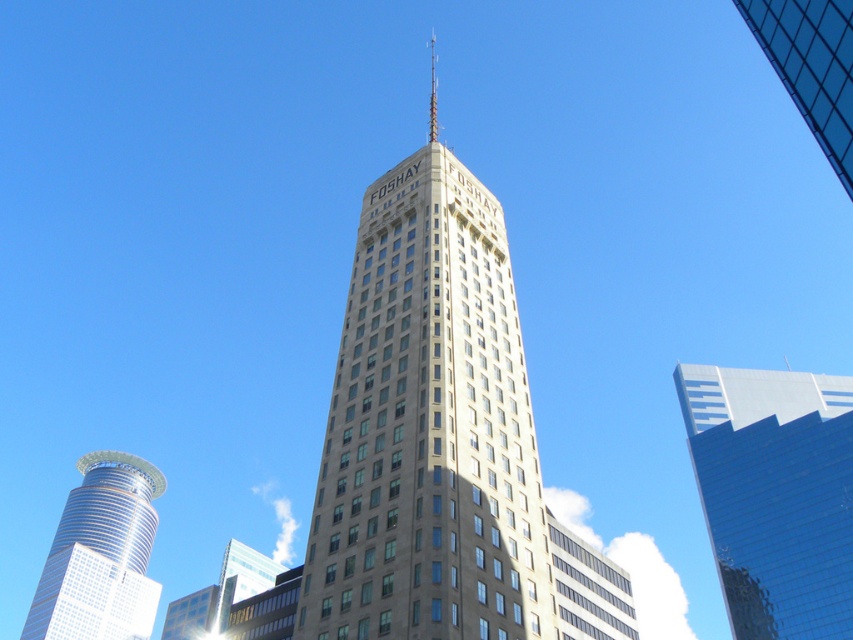
Question: Where is beige glass tower at center located in relation to glassy reflective skyscraper at right in the image?

Choices:
 (A) left
 (B) right

Answer: (A)

Question: Which point is farther to the camera?

Choices:
 (A) glassy reflective skyscraper at right
 (B) beige glass tower at center

Answer: (A)

Question: Which of the following is the closest to the observer?

Choices:
 (A) (491, 241)
 (B) (730, 522)
 (C) (775, 51)

Answer: (C)

Question: Is the position of beige glass tower at center less distant than that of glassy reflective skyscraper at right?

Choices:
 (A) yes
 (B) no

Answer: (A)

Question: Based on their relative distances, which object is farther from the beige glass tower at center?

Choices:
 (A) transparent glass building at upper right
 (B) glassy reflective skyscraper at right
 (C) shiny silver tower at lower left

Answer: (C)

Question: Is glassy reflective skyscraper at right bigger than shiny silver tower at lower left?

Choices:
 (A) no
 (B) yes

Answer: (A)